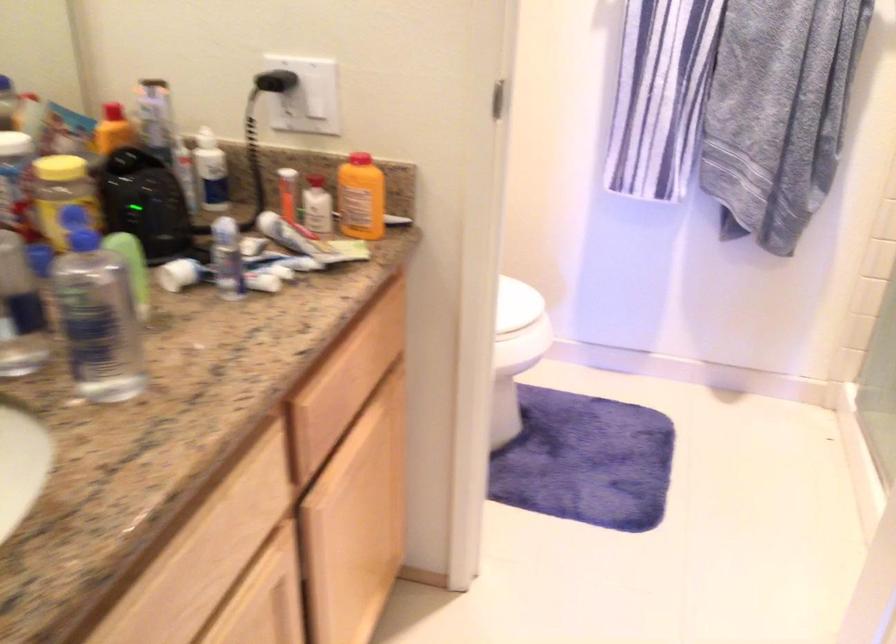
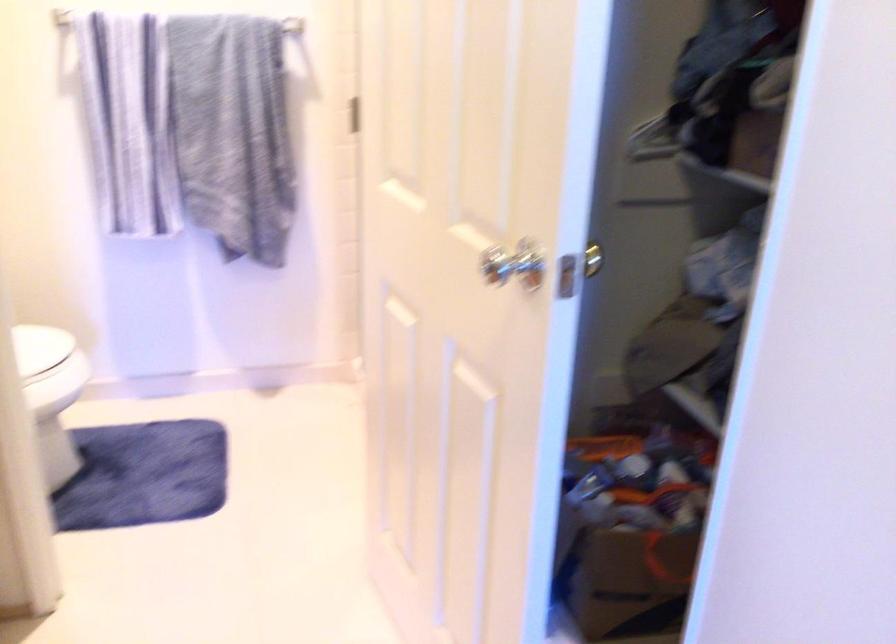
Locate, in the second image, the point that corresponds to the point at 511,328 in the first image.

(45, 368)